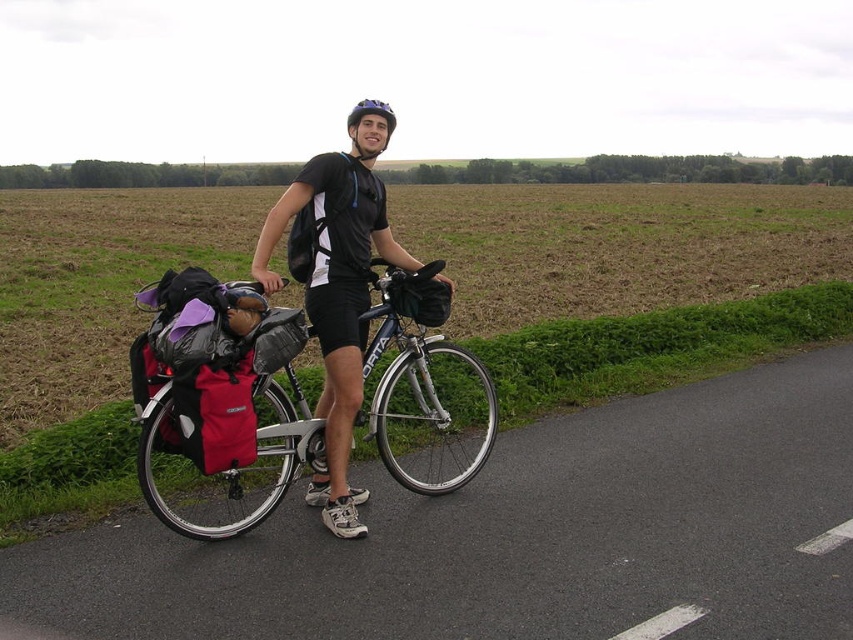
Question: Among these points, which one is nearest to the camera?

Choices:
 (A) (x=263, y=448)
 (B) (x=364, y=100)

Answer: (A)

Question: Can you confirm if matte black bicycle at center is positioned below purple matte bicycle helmet at center?

Choices:
 (A) no
 (B) yes

Answer: (B)

Question: Considering the real-world distances, which object is farthest from the purple matte bicycle helmet at center?

Choices:
 (A) matte black bicycle at center
 (B) black matte shirt at center

Answer: (B)

Question: Which object is positioned closest to the purple matte bicycle helmet at center?

Choices:
 (A) matte black bicycle at center
 (B) black matte shirt at center

Answer: (A)

Question: Considering the relative positions of matte black bicycle at center and purple matte bicycle helmet at center in the image provided, where is matte black bicycle at center located with respect to purple matte bicycle helmet at center?

Choices:
 (A) left
 (B) right

Answer: (B)

Question: From the image, what is the correct spatial relationship of black matte shirt at center in relation to purple matte bicycle helmet at center?

Choices:
 (A) left
 (B) right

Answer: (B)